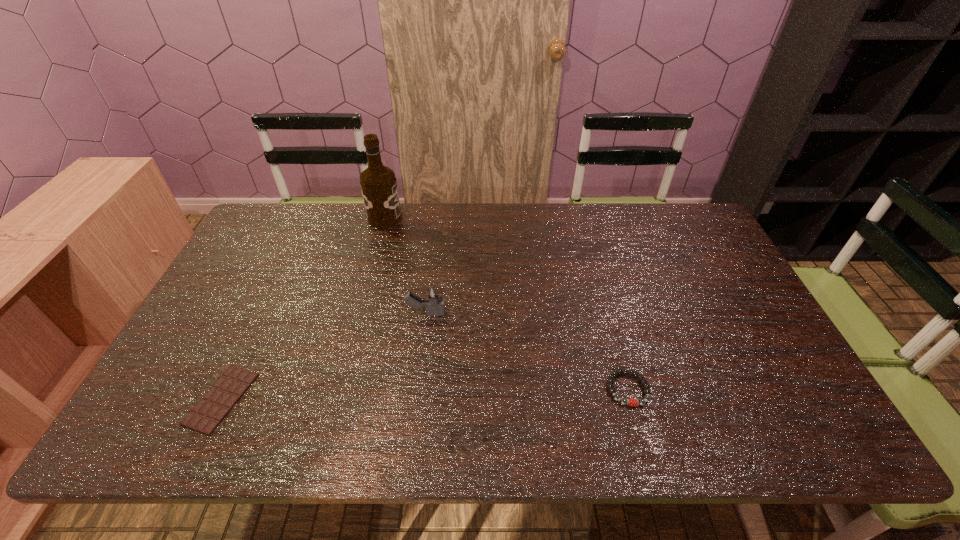
Identify the location of alcohol. The image size is (960, 540). (378, 183).

Find the location of `the tallest object`. the tallest object is located at coordinates (378, 183).

At what (x,y) coordinates should I click in order to perform the action: click on the third nearest object. Please return your answer as a coordinate pair (x, y). The height and width of the screenshot is (540, 960). Looking at the image, I should click on (433, 300).

Where is `the second object from right to left`? the second object from right to left is located at coordinates (433, 300).

You are a GUI agent. You are given a task and a screenshot of the screen. Output one action in this format:
    pyautogui.click(x=<x>, y=<y>)
    Task: Click on the third tallest object
    The image size is (960, 540).
    Given the screenshot: What is the action you would take?
    pyautogui.click(x=632, y=402)

Where is `bracelet`? bracelet is located at coordinates (632, 402).

You are a GUI agent. You are given a task and a screenshot of the screen. Output one action in this format:
    pyautogui.click(x=<x>, y=<y>)
    Task: Click on the shortest object
    
    Given the screenshot: What is the action you would take?
    pyautogui.click(x=205, y=416)

Find the location of a particular element. chocolate bar is located at coordinates (205, 416).

Locate an element on the screen. Image resolution: width=960 pixels, height=540 pixels. vacant space located 0.060m on the label of the third object from right to left is located at coordinates (419, 219).

At what (x,y) coordinates should I click in order to perform the action: click on vacant space located on the back of the second tallest object. Please return your answer as a coordinate pair (x, y). The height and width of the screenshot is (540, 960). Looking at the image, I should click on (437, 221).